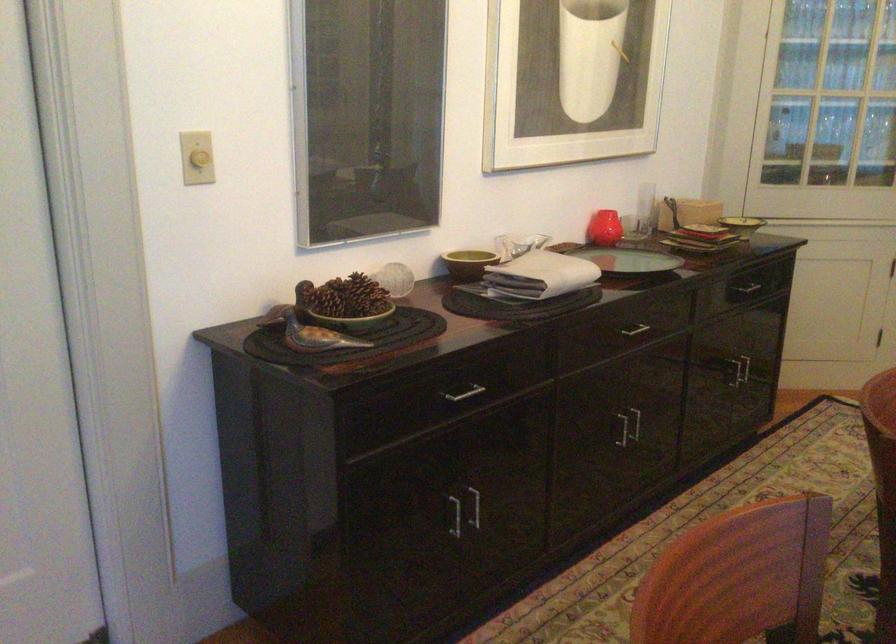
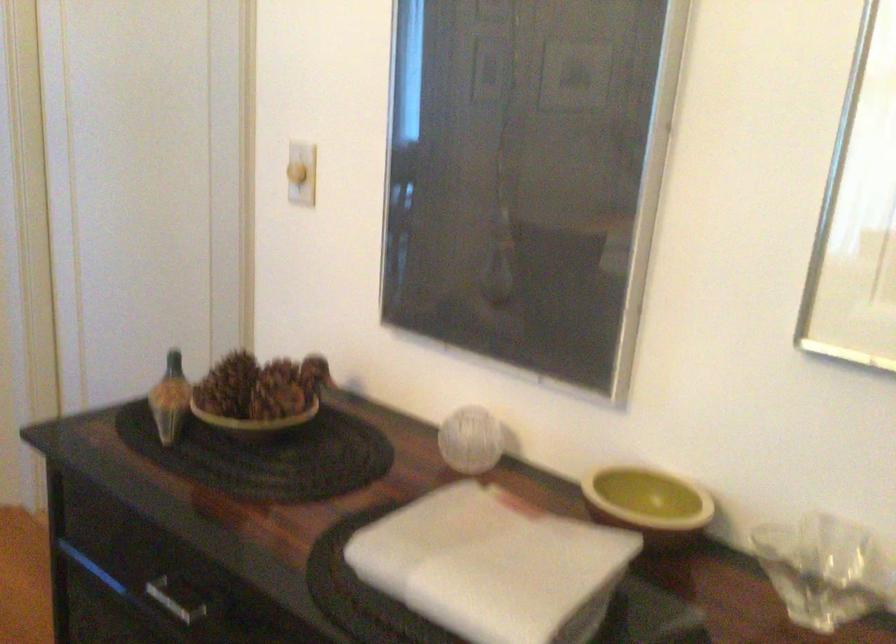
Where in the second image is the point corresponding to point 416,281 from the first image?

(470, 440)